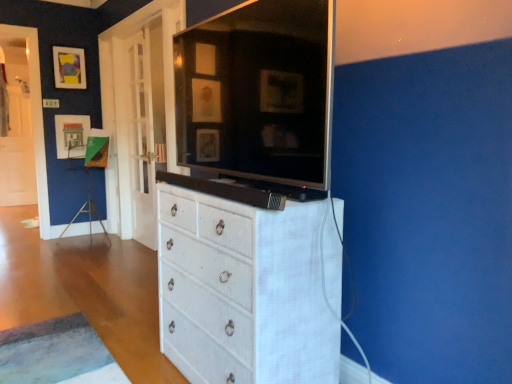
Question: Is matte black picture frame at upper left, marked as the first picture frame in a top-to-bottom arrangement, positioned beyond the bounds of white wicker chest of drawers at center?

Choices:
 (A) no
 (B) yes

Answer: (B)

Question: Is matte black picture frame at upper left, marked as the first picture frame in a top-to-bottom arrangement, thinner than white wicker chest of drawers at center?

Choices:
 (A) yes
 (B) no

Answer: (A)

Question: Is matte black picture frame at upper left, which is the 2th picture frame from bottom to top, to the left of white wicker chest of drawers at center from the viewer's perspective?

Choices:
 (A) no
 (B) yes

Answer: (B)

Question: Could you tell me if matte black picture frame at upper left, which is the 2th picture frame from bottom to top, is facing white wicker chest of drawers at center?

Choices:
 (A) yes
 (B) no

Answer: (A)

Question: Considering the relative positions of matte black picture frame at upper left, marked as the first picture frame in a top-to-bottom arrangement, and white wicker chest of drawers at center in the image provided, is matte black picture frame at upper left, marked as the first picture frame in a top-to-bottom arrangement, to the right of white wicker chest of drawers at center from the viewer's perspective?

Choices:
 (A) yes
 (B) no

Answer: (B)

Question: Can you confirm if matte black picture frame at upper left, which is the 2th picture frame from bottom to top, is wider than white wicker chest of drawers at center?

Choices:
 (A) no
 (B) yes

Answer: (A)

Question: Considering the relative sizes of white textured cabinet at center and white glass door at left in the image provided, is white textured cabinet at center bigger than white glass door at left?

Choices:
 (A) no
 (B) yes

Answer: (A)

Question: From a real-world perspective, is white textured cabinet at center physically above white glass door at left?

Choices:
 (A) yes
 (B) no

Answer: (A)

Question: Is white textured cabinet at center not inside white glass door at left?

Choices:
 (A) no
 (B) yes

Answer: (B)

Question: Is white glass door at left inside white textured cabinet at center?

Choices:
 (A) yes
 (B) no

Answer: (B)

Question: From a real-world perspective, does white textured cabinet at center sit lower than white glass door at left?

Choices:
 (A) no
 (B) yes

Answer: (A)

Question: Is white textured cabinet at center taller than white glass door at left?

Choices:
 (A) yes
 (B) no

Answer: (B)

Question: From a real-world perspective, is white textured cabinet at center positioned under matte black picture frame at upper left, marked as the first picture frame in a top-to-bottom arrangement, based on gravity?

Choices:
 (A) no
 (B) yes

Answer: (B)